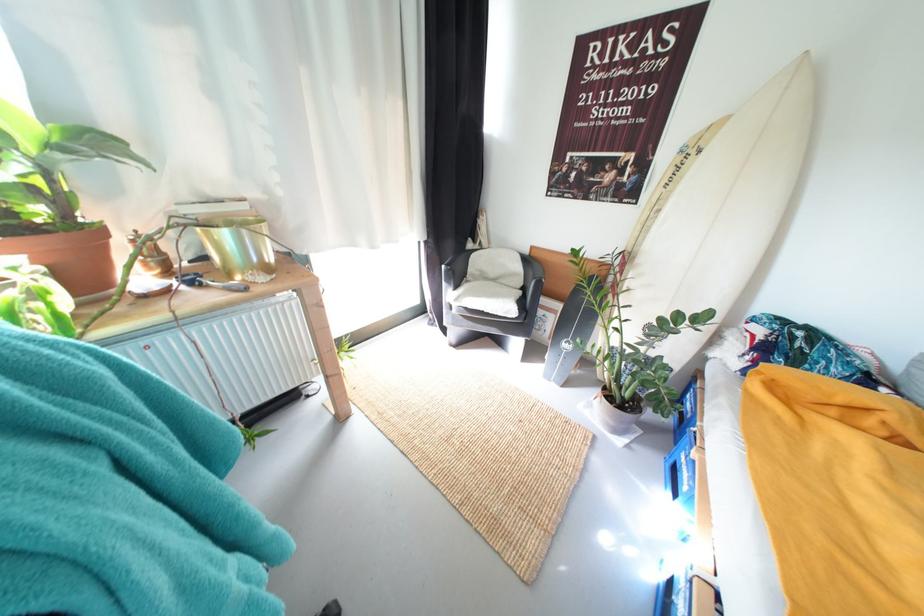
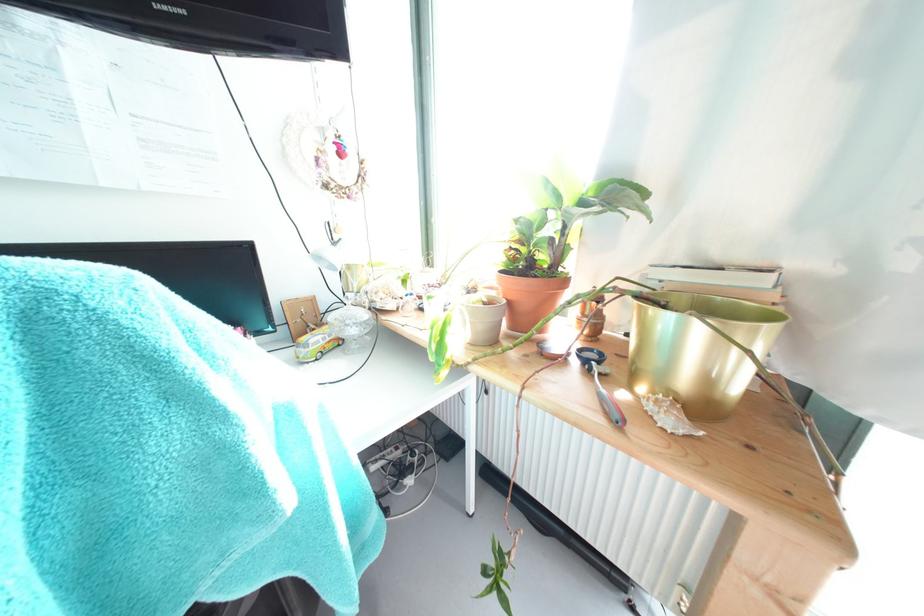
The point at (233, 236) is marked in the first image. Where is the corresponding point in the second image?

(675, 321)